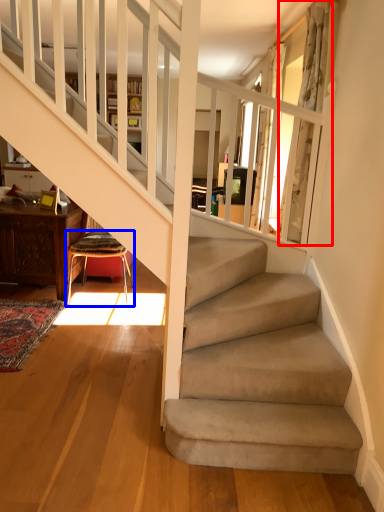
Question: Among these objects, which one is nearest to the camera, curtain (highlighted by a red box) or chair (highlighted by a blue box)?

Choices:
 (A) curtain
 (B) chair

Answer: (A)